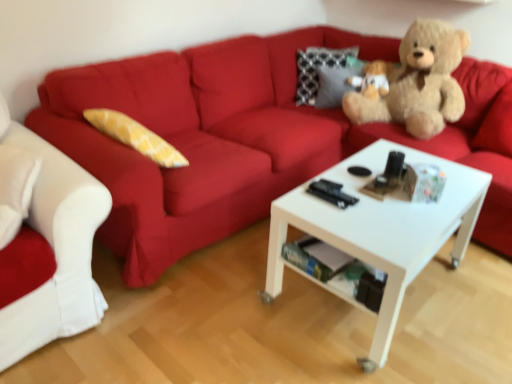
Question: Considering the relative sizes of matte red couch at upper center, arranged as the 2th studio couch when viewed from the left, and white fabric couch at left, which is the second studio couch in right-to-left order, in the image provided, is matte red couch at upper center, arranged as the 2th studio couch when viewed from the left, bigger than white fabric couch at left, which is the second studio couch in right-to-left order,?

Choices:
 (A) no
 (B) yes

Answer: (B)

Question: Is the position of matte red couch at upper center, marked as the first studio couch in a right-to-left arrangement, more distant than that of white fabric couch at left, which is the second studio couch in right-to-left order?

Choices:
 (A) no
 (B) yes

Answer: (A)

Question: From a real-world perspective, is matte red couch at upper center, arranged as the 2th studio couch when viewed from the left, located higher than white fabric couch at left, which is the first studio couch from left to right?

Choices:
 (A) no
 (B) yes

Answer: (A)

Question: From the image's perspective, is matte red couch at upper center, marked as the first studio couch in a right-to-left arrangement, on top of white fabric couch at left, which is the first studio couch from left to right?

Choices:
 (A) no
 (B) yes

Answer: (B)

Question: Does matte red couch at upper center, arranged as the 2th studio couch when viewed from the left, have a greater height compared to white fabric couch at left, which is the first studio couch from left to right?

Choices:
 (A) yes
 (B) no

Answer: (A)

Question: Looking at their shapes, would you say matte red couch at upper center, marked as the first studio couch in a right-to-left arrangement, is wider or thinner than white fabric couch at left, which is the second studio couch in right-to-left order?

Choices:
 (A) thin
 (B) wide

Answer: (B)

Question: Is point (125, 213) positioned closer to the camera than point (97, 193)?

Choices:
 (A) closer
 (B) farther

Answer: (B)

Question: Is matte red couch at upper center, marked as the first studio couch in a right-to-left arrangement, inside or outside of white fabric couch at left, which is the second studio couch in right-to-left order?

Choices:
 (A) inside
 (B) outside

Answer: (B)

Question: From their relative heights in the image, would you say matte red couch at upper center, marked as the first studio couch in a right-to-left arrangement, is taller or shorter than white fabric couch at left, which is the first studio couch from left to right?

Choices:
 (A) tall
 (B) short

Answer: (A)

Question: Considering the positions of point (321, 39) and point (412, 33), is point (321, 39) closer or farther from the camera than point (412, 33)?

Choices:
 (A) closer
 (B) farther

Answer: (B)

Question: Relative to soft brown teddy bear at upper right, is matte red couch at upper center, marked as the first studio couch in a right-to-left arrangement, in front or behind?

Choices:
 (A) behind
 (B) front

Answer: (B)

Question: Looking at their shapes, would you say matte red couch at upper center, marked as the first studio couch in a right-to-left arrangement, is wider or thinner than soft brown teddy bear at upper right?

Choices:
 (A) wide
 (B) thin

Answer: (A)

Question: From a real-world perspective, is matte red couch at upper center, arranged as the 2th studio couch when viewed from the left, positioned above or below soft brown teddy bear at upper right?

Choices:
 (A) below
 (B) above

Answer: (A)

Question: Visually, is soft brown teddy bear at upper right positioned to the left or to the right of white fabric couch at left, which is the second studio couch in right-to-left order?

Choices:
 (A) right
 (B) left

Answer: (A)

Question: Based on their sizes in the image, would you say soft brown teddy bear at upper right is bigger or smaller than white fabric couch at left, which is the second studio couch in right-to-left order?

Choices:
 (A) big
 (B) small

Answer: (A)